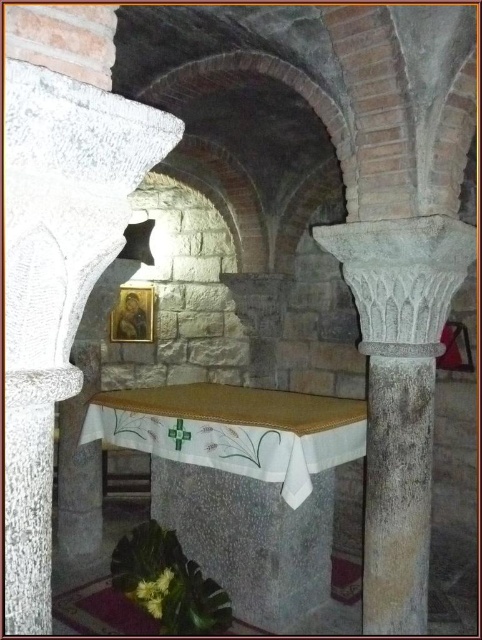
Question: Which point is farther from the camera taking this photo?

Choices:
 (A) (66, 387)
 (B) (380, 272)

Answer: (B)

Question: Which object is farther from the camera taking this photo?

Choices:
 (A) gray stone column at center
 (B) granite column at left

Answer: (A)

Question: Does granite column at left have a lesser width compared to gray stone column at center?

Choices:
 (A) yes
 (B) no

Answer: (A)

Question: Which point is closer to the camera?

Choices:
 (A) (433, 362)
 (B) (18, 433)

Answer: (B)

Question: In this image, where is granite column at left located relative to gray stone column at center?

Choices:
 (A) right
 (B) left

Answer: (B)

Question: Is granite column at left above gray stone column at center?

Choices:
 (A) no
 (B) yes

Answer: (B)